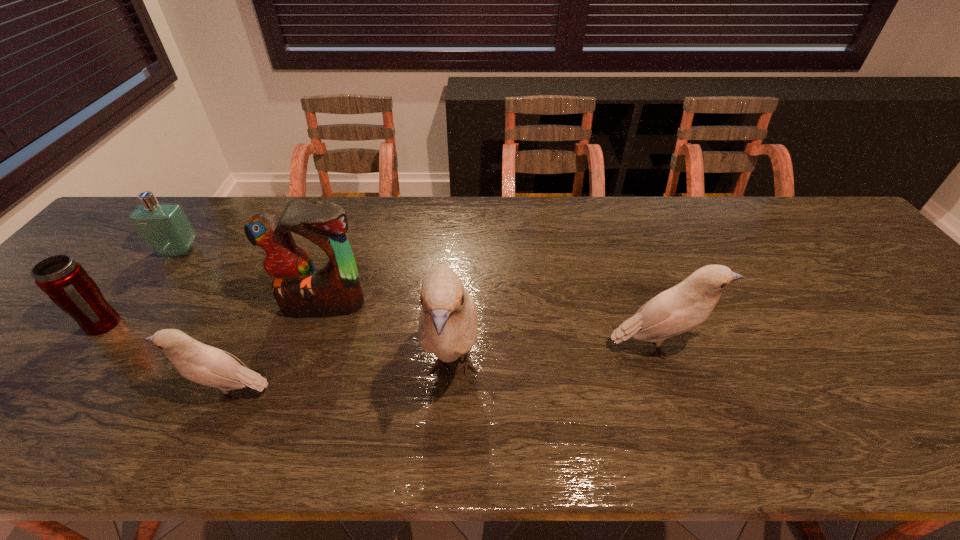
Please point a spot to add another bird on the right. Please provide its 2D coordinates. Your answer should be formatted as a tuple, i.e. [(x, y)], where the tuple contains the x and y coordinates of a point satisfying the conditions above.

[(845, 327)]